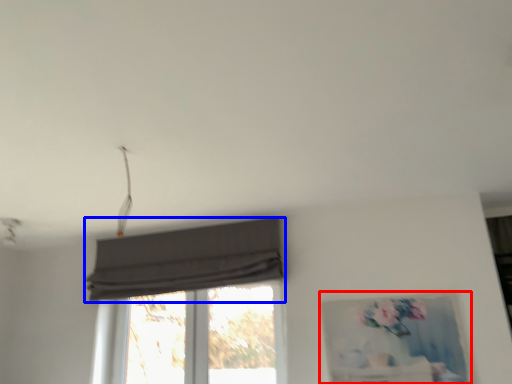
Question: Among these objects, which one is nearest to the camera, picture frame (highlighted by a red box) or curtain (highlighted by a blue box)?

Choices:
 (A) picture frame
 (B) curtain

Answer: (A)